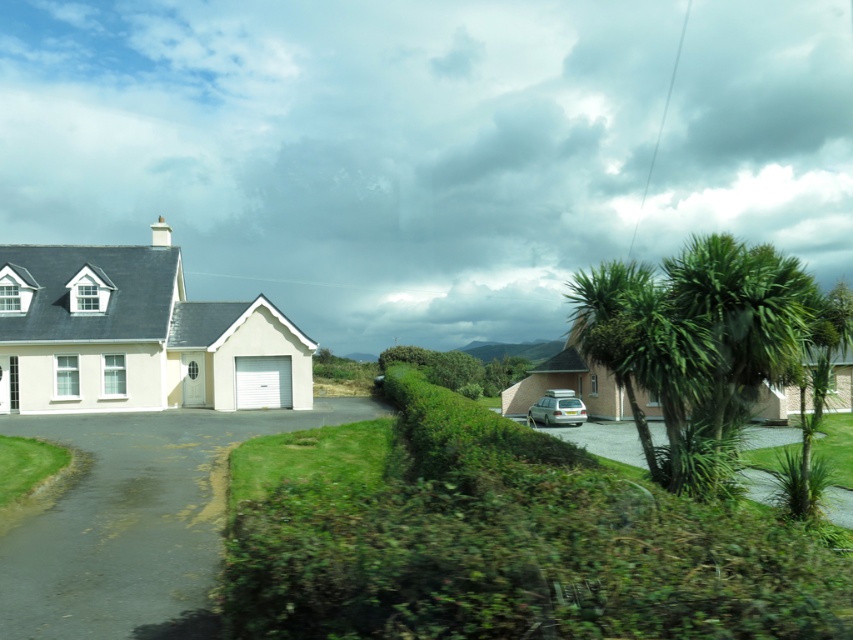
You are standing on the road between the two houses and want to walk to the gray asphalt driveway at lower left and the gray asphalt driveway at lower center. Which driveway will you reach first?

You will reach the gray asphalt driveway at lower left first because it is closer to you than the gray asphalt driveway at lower center.

You are a delivery driver trying to park your truck in the driveway. You see the gray asphalt driveway at lower left and the gray asphalt driveway at lower center. Which driveway has enough space for your truck?

The gray asphalt driveway at lower left has a larger width than the gray asphalt driveway at lower center, so it has enough space for the truck.